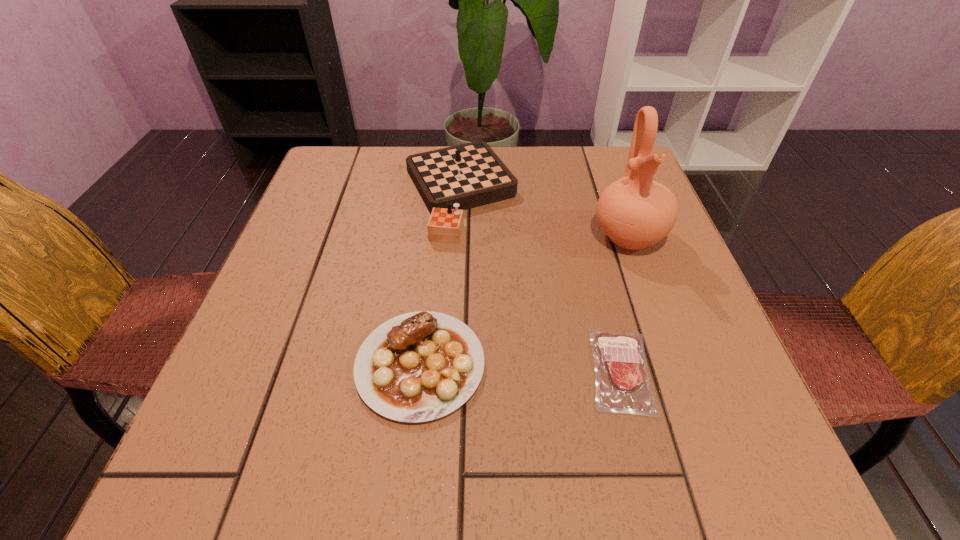
Select which object is the second closest to the shorter steak. Please provide its 2D coordinates. Your answer should be formatted as a tuple, i.e. [(x, y)], where the tuple contains the x and y coordinates of a point satisfying the conditions above.

[(635, 212)]